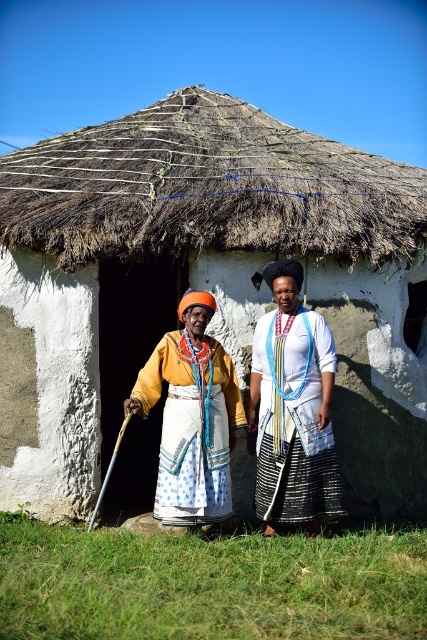
Question: Observing the image, what is the correct spatial positioning of white woven fabric dress at center in reference to matte yellow fabric dress at center?

Choices:
 (A) above
 (B) below

Answer: (A)

Question: Is thatched straw roof at center further to the viewer compared to white woven fabric dress at center?

Choices:
 (A) no
 (B) yes

Answer: (B)

Question: Does white stucco hut at center lie in front of white woven fabric dress at center?

Choices:
 (A) yes
 (B) no

Answer: (B)

Question: Which of the following is the closest to the observer?

Choices:
 (A) (397, 196)
 (B) (234, 401)
 (C) (312, 496)
 (D) (131, 237)

Answer: (C)

Question: Among these objects, which one is farthest from the camera?

Choices:
 (A) white woven fabric dress at center
 (B) thatched straw roof at center
 (C) white stucco hut at center

Answer: (C)

Question: Which object is closer to the camera taking this photo?

Choices:
 (A) matte yellow fabric dress at center
 (B) thatched straw roof at center
 (C) white woven fabric dress at center

Answer: (A)